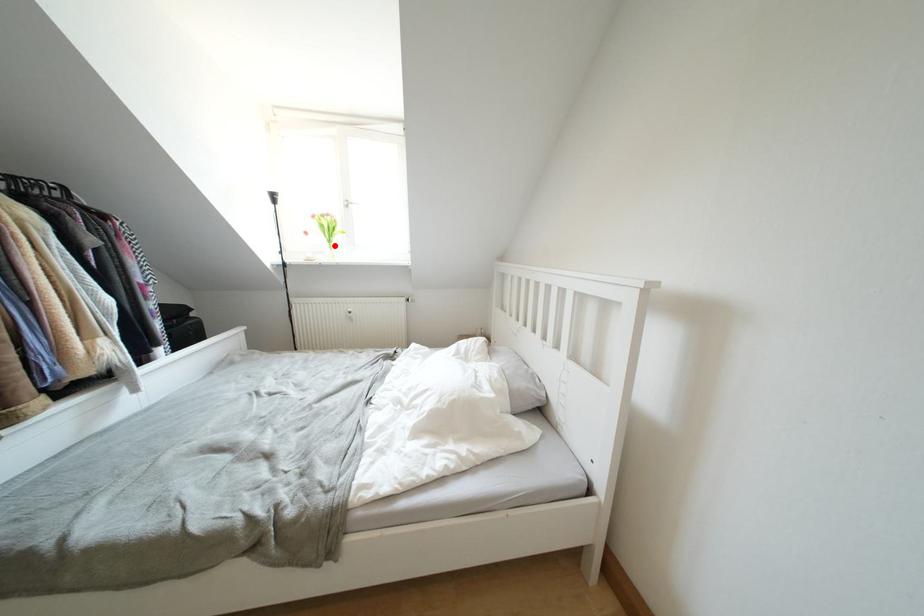
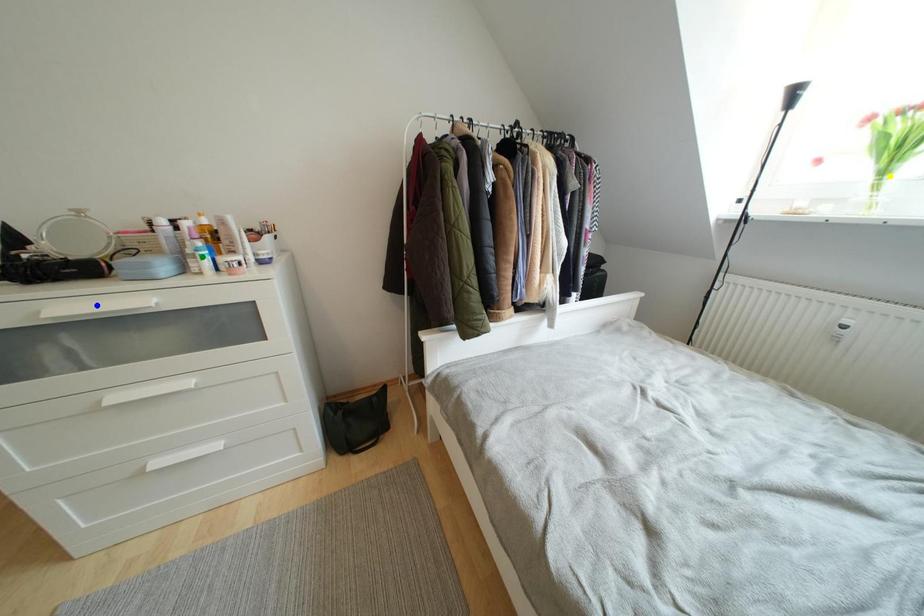
Question: I am providing you with two images of the same scene from different viewpoints. A red point is marked on the first image. You are given multiple points on the second image. Can you choose the point in image 2 that corresponds to the point in image 1?

Choices:
 (A) blue point
 (B) yellow point
 (C) green point

Answer: (B)